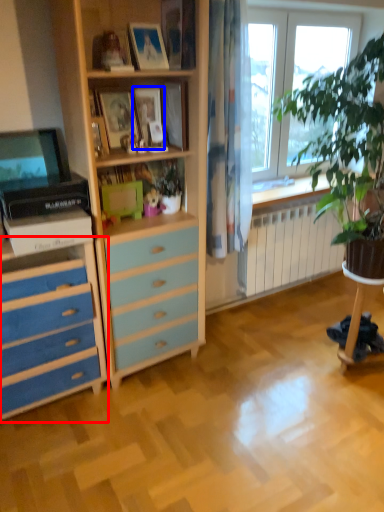
Question: Among these objects, which one is nearest to the camera, chest of drawers (highlighted by a red box) or picture frame (highlighted by a blue box)?

Choices:
 (A) chest of drawers
 (B) picture frame

Answer: (A)